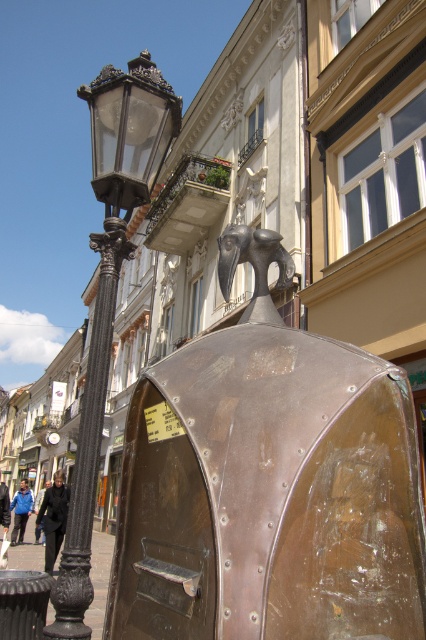
You are a street performer who wants to place a small stool between the black wrought iron pole at left and the polished bronze bird at center. Is there enough space for the stool?

The polished bronze bird at center is behind the black wrought iron pole at left, so there is no space between them for the stool.